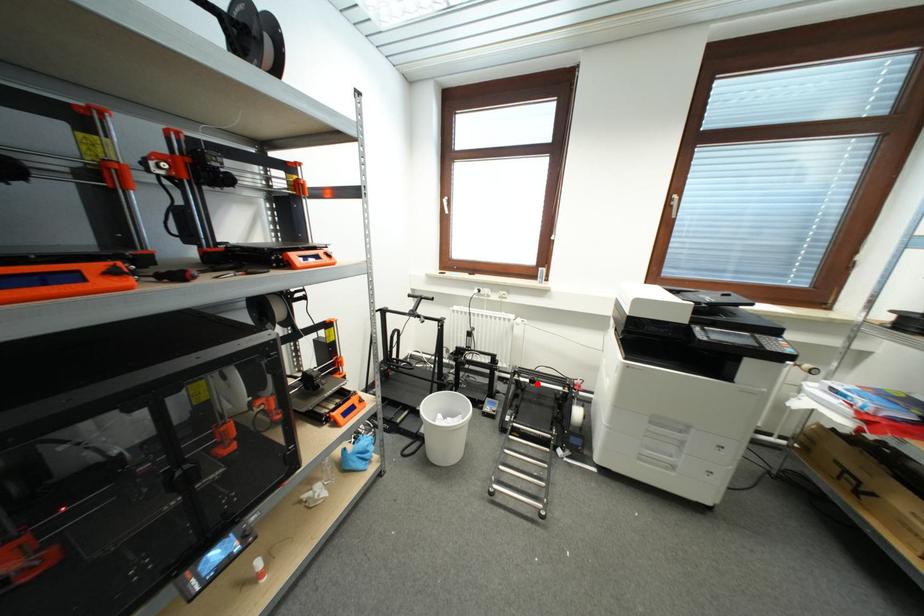
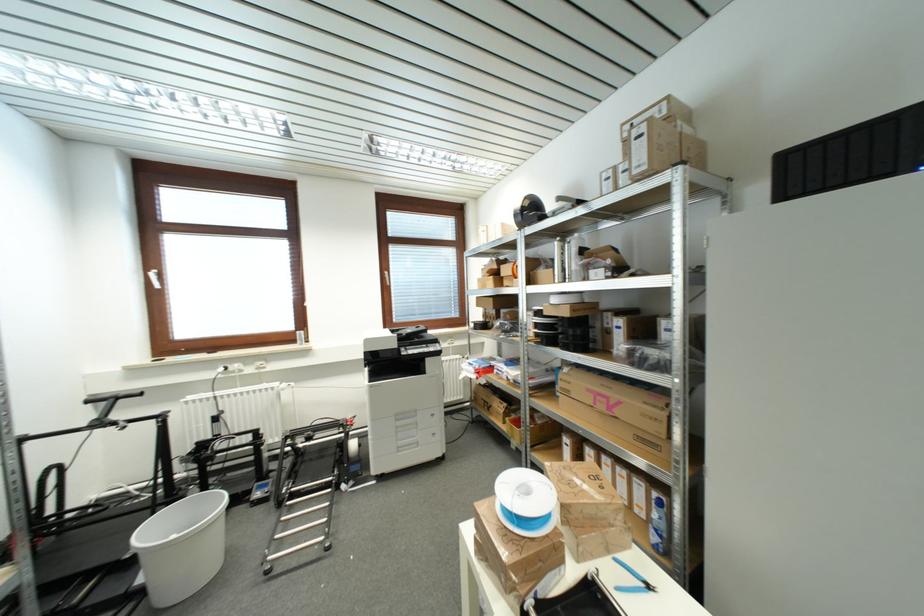
The point at the highlighted location is marked in the first image. Where is the corresponding point in the second image?

(313, 440)